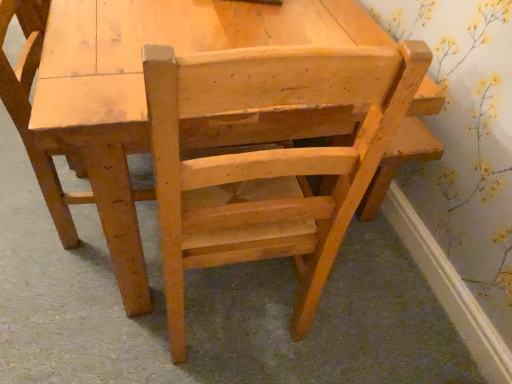
Question: Would you say light brown wood chair at center, placed as the second chair when sorted from right to left, is inside or outside natural wood chair at center, acting as the 1th chair starting from the right?

Choices:
 (A) outside
 (B) inside

Answer: (A)

Question: Considering the positions of light brown wood chair at center, placed as the second chair when sorted from right to left, and natural wood chair at center, positioned as the 2th chair in left-to-right order, in the image, is light brown wood chair at center, placed as the second chair when sorted from right to left, bigger or smaller than natural wood chair at center, positioned as the 2th chair in left-to-right order,?

Choices:
 (A) big
 (B) small

Answer: (B)

Question: From their relative heights in the image, would you say light brown wood chair at center, marked as the 1th chair in a left-to-right arrangement, is taller or shorter than natural wood chair at center, positioned as the 2th chair in left-to-right order?

Choices:
 (A) tall
 (B) short

Answer: (A)

Question: From a real-world perspective, is natural wood chair at center, acting as the 1th chair starting from the right, positioned above or below light brown wood chair at center, marked as the 1th chair in a left-to-right arrangement?

Choices:
 (A) above
 (B) below

Answer: (B)

Question: Is natural wood chair at center, acting as the 1th chair starting from the right, taller or shorter than light brown wood chair at center, marked as the 1th chair in a left-to-right arrangement?

Choices:
 (A) tall
 (B) short

Answer: (B)

Question: From the image's perspective, is natural wood chair at center, positioned as the 2th chair in left-to-right order, located above or below light brown wood chair at center, marked as the 1th chair in a left-to-right arrangement?

Choices:
 (A) below
 (B) above

Answer: (A)

Question: Do you think natural wood chair at center, positioned as the 2th chair in left-to-right order, is within light brown wood chair at center, placed as the second chair when sorted from right to left, or outside of it?

Choices:
 (A) inside
 (B) outside

Answer: (B)